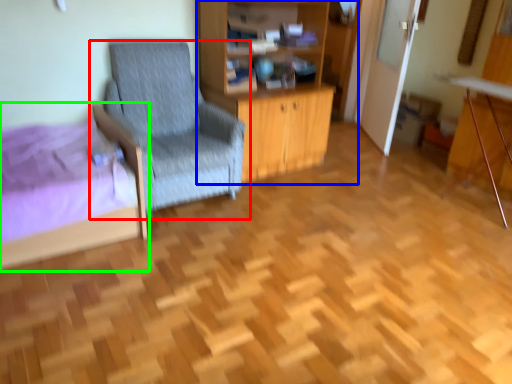
Question: Which object is the closest to the chair (highlighted by a red box)? Choose among these: dresser (highlighted by a blue box) or bed (highlighted by a green box).

Choices:
 (A) dresser
 (B) bed

Answer: (A)